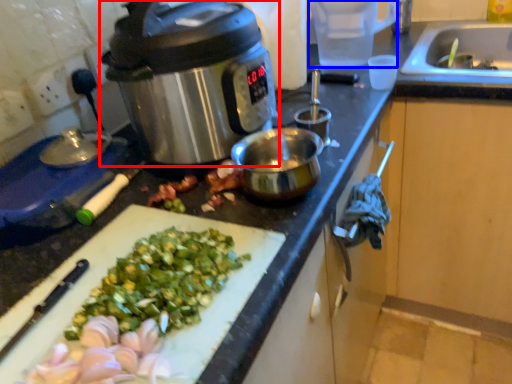
Question: Which point is further to the camera, slow cooker (highlighted by a red box) or appliance (highlighted by a blue box)?

Choices:
 (A) slow cooker
 (B) appliance

Answer: (B)